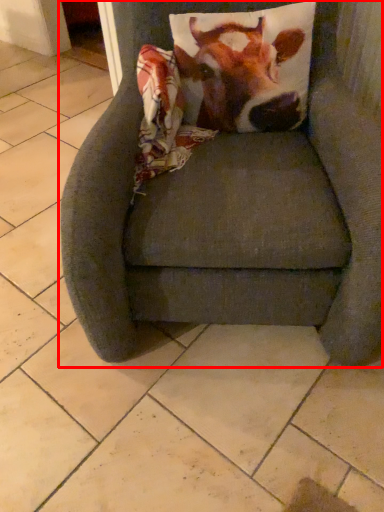
Question: From the image's perspective, what is the correct spatial positioning of chair (annotated by the red box) in reference to cattle?

Choices:
 (A) below
 (B) above

Answer: (A)